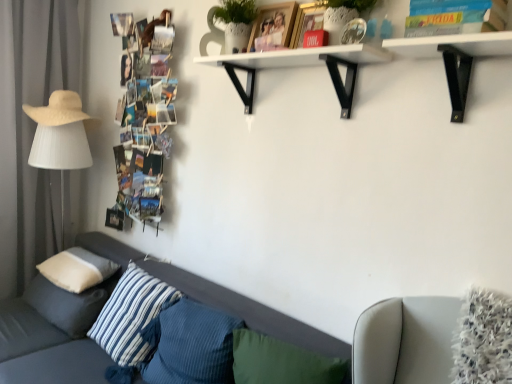
Question: Looking at the image, does white matte shelf at upper center seem bigger or smaller compared to gray fabric curtain at left?

Choices:
 (A) big
 (B) small

Answer: (B)

Question: From a real-world perspective, relative to gray fabric curtain at left, is white matte shelf at upper center vertically above or below?

Choices:
 (A) above
 (B) below

Answer: (A)

Question: Which object is positioned farthest from the gray fabric curtain at left?

Choices:
 (A) textured gray couch at lower left
 (B) white soft cushion at lower left, the 1th pillow viewed from the left
 (C) white matte table lamp at left
 (D) strawmaterial/texturehat at left
 (E) blue striped pillow at lower left, the 2th pillow positioned from the right

Answer: (E)

Question: Estimate the real-world distances between objects in this image. Which object is closer to the strawmaterial/texturehat at left?

Choices:
 (A) white soft cushion at lower left, which is the 4th pillow in right-to-left order
 (B) matte red book at upper center, the 2th book positioned from the left
 (C) gray fabric curtain at left
 (D) blue striped pillow at lower left, placed as the first pillow when sorted from right to left
 (E) white matte shelf at upper center

Answer: (C)